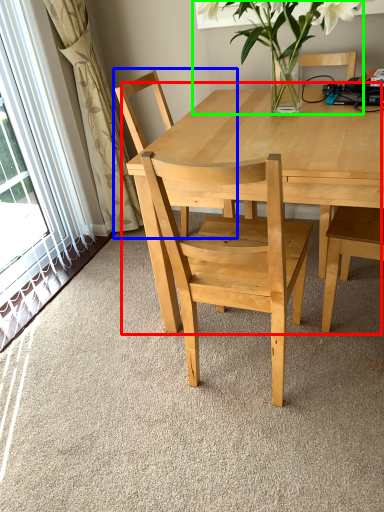
Question: Which is farther away from kitchen & dining room table (highlighted by a red box)? chair (highlighted by a blue box) or houseplant (highlighted by a green box)?

Choices:
 (A) chair
 (B) houseplant

Answer: (A)